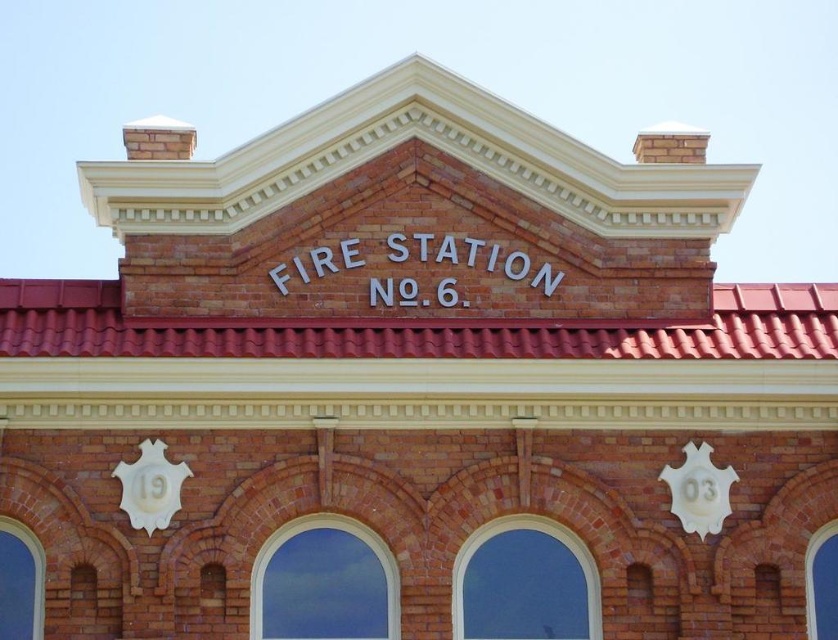
Question: Is white glossy shield at center positioned behind white glossy clock at lower left?

Choices:
 (A) no
 (B) yes

Answer: (B)

Question: Does white glossy shield at center appear over white glossy clock at lower left?

Choices:
 (A) no
 (B) yes

Answer: (B)

Question: Does white glossy shield at center appear on the right side of white glossy clock at lower left?

Choices:
 (A) yes
 (B) no

Answer: (A)

Question: Which point is closer to the camera?

Choices:
 (A) white glossy clock at lower left
 (B) white glossy shield at center

Answer: (A)